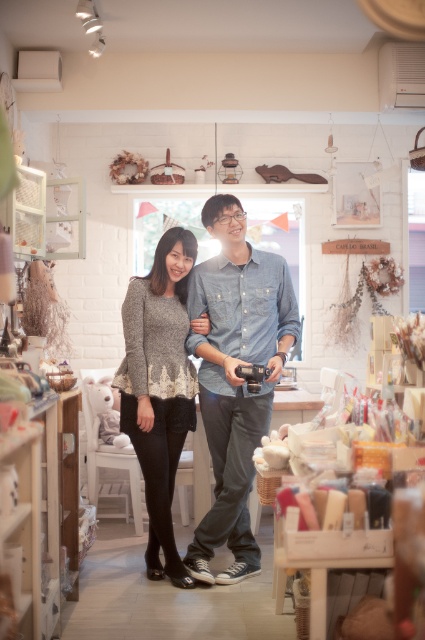
Question: Does denim shirt at center appear on the right side of knitted gray sweater at center?

Choices:
 (A) no
 (B) yes

Answer: (B)

Question: Does denim shirt at center appear over knitted gray sweater at center?

Choices:
 (A) no
 (B) yes

Answer: (B)

Question: Is denim shirt at center to the left of knitted gray sweater at center from the viewer's perspective?

Choices:
 (A) no
 (B) yes

Answer: (A)

Question: Which object appears closest to the camera in this image?

Choices:
 (A) denim shirt at center
 (B) knitted gray sweater at center

Answer: (A)